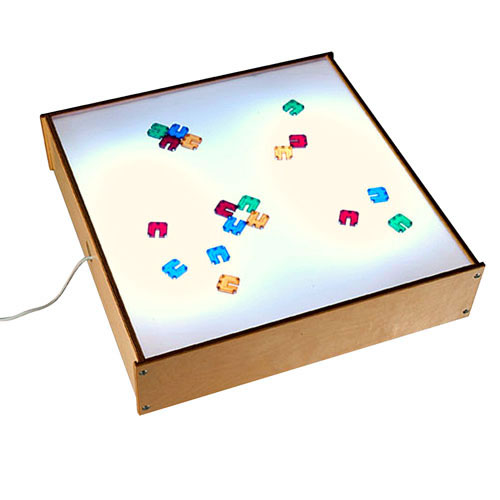
Where is `cord`? The image size is (500, 500). cord is located at coordinates (47, 304).